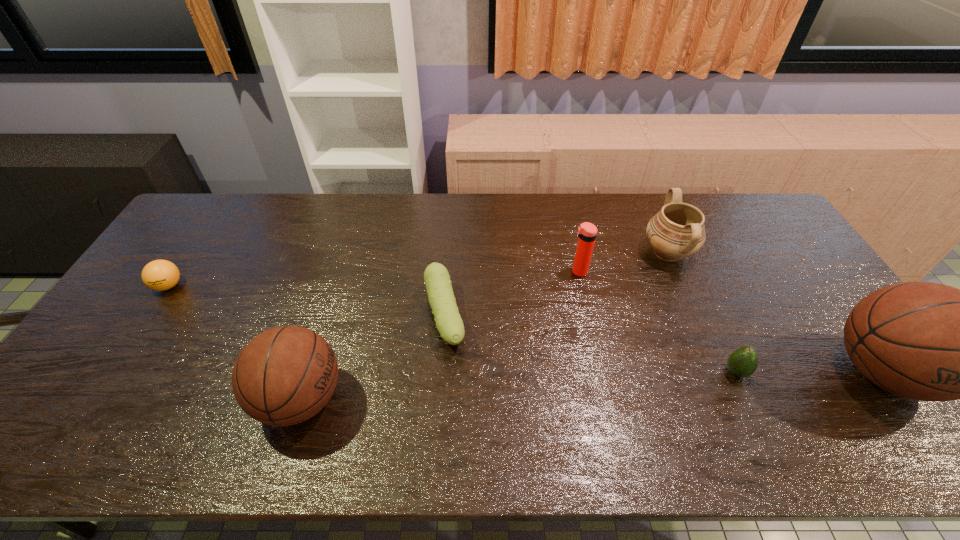
This screenshot has width=960, height=540. Identify the location of free space located 0.340m on the back of the thermos bottle. pyautogui.click(x=564, y=202).

This screenshot has height=540, width=960. I want to click on vacant area situated on the left of the avocado, so [692, 372].

At what (x,y) coordinates should I click in order to perform the action: click on vacant space located 0.140m on the front-facing side of the urn. Please return your answer as a coordinate pair (x, y). The width and height of the screenshot is (960, 540). Looking at the image, I should click on (598, 253).

Locate an element on the screen. Image resolution: width=960 pixels, height=540 pixels. free space located on the front-facing side of the urn is located at coordinates (616, 253).

You are a GUI agent. You are given a task and a screenshot of the screen. Output one action in this format:
    pyautogui.click(x=<x>, y=<y>)
    Task: Click on the vacant space situated on the front-facing side of the urn
    This screenshot has height=540, width=960.
    Given the screenshot: What is the action you would take?
    pyautogui.click(x=552, y=253)

At what (x,y) coordinates should I click in order to perform the action: click on object that is positioned at the far edge. Please return your answer as a coordinate pair (x, y). Looking at the image, I should click on (677, 231).

This screenshot has height=540, width=960. What are the coordinates of `basketball present at the near edge` in the screenshot? It's located at (285, 375).

Locate an element on the screen. The width and height of the screenshot is (960, 540). avocado positioned at the near edge is located at coordinates (743, 362).

Where is `object at the left edge`? Image resolution: width=960 pixels, height=540 pixels. object at the left edge is located at coordinates (160, 275).

Find the location of a particular element. Image resolution: width=960 pixels, height=540 pixels. vacant space at the far edge of the desktop is located at coordinates (269, 210).